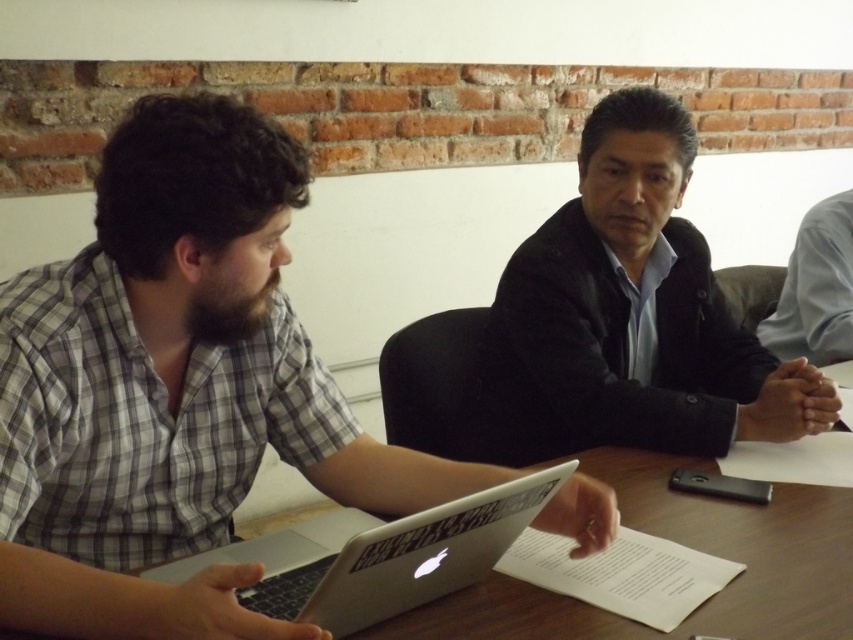
Which is behind, point (233, 108) or point (671, 170)?

Point (671, 170)

Does point (276, 269) come behind point (636, 429)?

No, (276, 269) is in front of (636, 429).

Is point (3, 406) farther from viewer compared to point (732, 428)?

No, (3, 406) is closer to viewer.

Find the location of `matte black laptop at left`. matte black laptop at left is located at coordinates (173, 387).

The image size is (853, 640). What do you see at coordinates (628, 317) in the screenshot? I see `black leather jacket at center` at bounding box center [628, 317].

From the picture: How much distance is there between black leather jacket at center and silver metallic laptop at center?

They are 25.47 inches apart.

Is point (672, 256) positioned before point (347, 586)?

No, it is behind (347, 586).

Identify the location of black leather jacket at center. The image size is (853, 640). (628, 317).

Between matte black laptop at left and silver metallic laptop at center, which one is positioned lower?

Positioned lower is silver metallic laptop at center.

Which is above, matte black laptop at left or silver metallic laptop at center?

Positioned higher is matte black laptop at left.

Where is `matte black laptop at left`? This screenshot has height=640, width=853. matte black laptop at left is located at coordinates (173, 387).

Locate an element on the screen. Image resolution: width=853 pixels, height=640 pixels. matte black laptop at left is located at coordinates (173, 387).